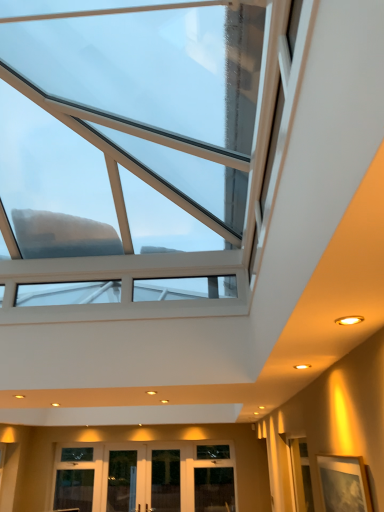
Question: From a real-world perspective, is wooden picture frame at lower right physically located above or below transparent glass door at lower center, placed as the first glass door when sorted from left to right?

Choices:
 (A) above
 (B) below

Answer: (A)

Question: Is wooden picture frame at lower right situated inside transparent glass door at lower center, the 3th glass door positioned from the right, or outside?

Choices:
 (A) outside
 (B) inside

Answer: (A)

Question: Which of these objects is positioned closest to the transparent glass door at center, the 1th glass door positioned from the right?

Choices:
 (A) clear glass door at center, the 2th glass door in the right-to-left sequence
 (B) wooden picture frame at lower right
 (C) transparent glass skylight at upper center
 (D) transparent glass door at lower center, placed as the first glass door when sorted from left to right

Answer: (A)

Question: Which object is the closest to the transparent glass skylight at upper center?

Choices:
 (A) transparent glass door at lower center, the 3th glass door positioned from the right
 (B) transparent glass door at center, the 3th glass door when ordered from left to right
 (C) wooden picture frame at lower right
 (D) clear glass door at center, the 2th glass door from the left

Answer: (C)